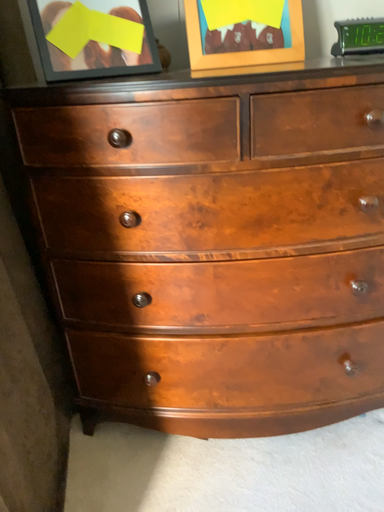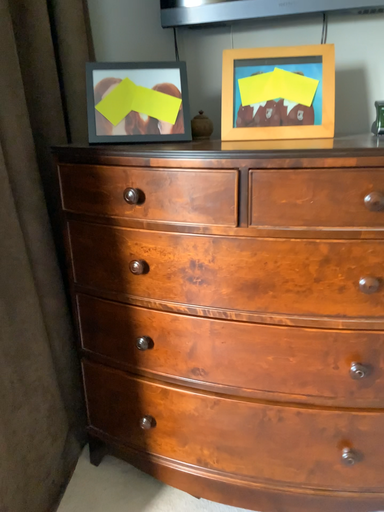
Question: How did the camera likely rotate when shooting the video?

Choices:
 (A) rotated upward
 (B) rotated downward

Answer: (A)